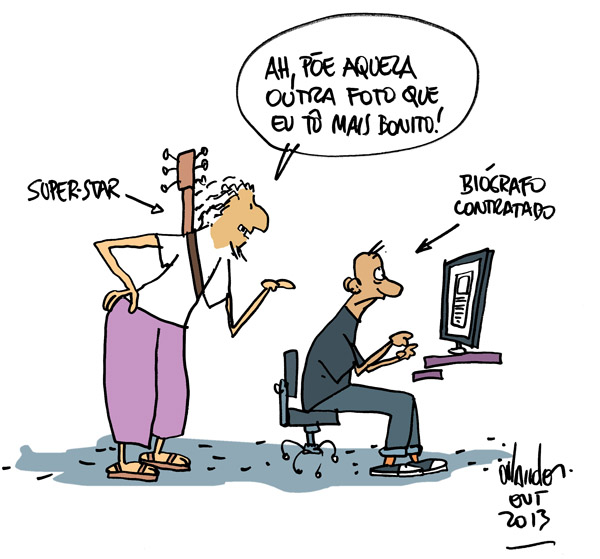
I want to click on computer screen, so click(478, 280).